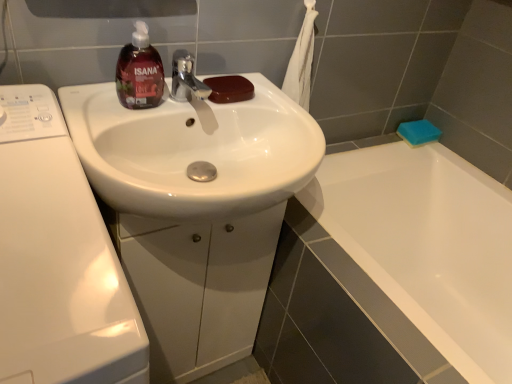
Question: From a real-world perspective, is brown glossy soap at center, which is the 1th soap in front-to-back order, positioned under white glossy cabinet at center based on gravity?

Choices:
 (A) yes
 (B) no

Answer: (B)

Question: Is brown glossy soap at center, which is the 2th soap in right-to-left order, not near white glossy cabinet at center?

Choices:
 (A) no
 (B) yes

Answer: (A)

Question: From the image's perspective, is brown glossy soap at center, the second soap from the back, on top of white glossy cabinet at center?

Choices:
 (A) no
 (B) yes

Answer: (B)

Question: Is brown glossy soap at center, the second soap from the back, to the left of white glossy cabinet at center from the viewer's perspective?

Choices:
 (A) yes
 (B) no

Answer: (B)

Question: Can you confirm if brown glossy soap at center, which is the 1th soap in front-to-back order, is wider than white glossy cabinet at center?

Choices:
 (A) no
 (B) yes

Answer: (A)

Question: Considering the positions of brown glossy soap at center, which is the 1th soap in front-to-back order, and white glossy cabinet at center in the image, is brown glossy soap at center, which is the 1th soap in front-to-back order, bigger or smaller than white glossy cabinet at center?

Choices:
 (A) small
 (B) big

Answer: (A)

Question: From the image's perspective, is brown glossy soap at center, placed as the first soap when sorted from left to right, located above or below white glossy cabinet at center?

Choices:
 (A) below
 (B) above

Answer: (B)

Question: From a real-world perspective, is brown glossy soap at center, which is the 2th soap in right-to-left order, positioned above or below white glossy cabinet at center?

Choices:
 (A) above
 (B) below

Answer: (A)

Question: Looking at their shapes, would you say brown glossy soap at center, which is the 2th soap in right-to-left order, is wider or thinner than white glossy cabinet at center?

Choices:
 (A) thin
 (B) wide

Answer: (A)

Question: Visually, is blue sponge at upper right, which is the first soap from right to left, positioned to the left or to the right of white glossy sink at center?

Choices:
 (A) right
 (B) left

Answer: (A)

Question: Looking at the image, does blue sponge at upper right, which appears as the first soap when viewed from the back, seem bigger or smaller compared to white glossy sink at center?

Choices:
 (A) big
 (B) small

Answer: (B)

Question: From a real-world perspective, is blue sponge at upper right, which is the first soap from right to left, physically located above or below white glossy sink at center?

Choices:
 (A) below
 (B) above

Answer: (A)

Question: Relative to white glossy sink at center, is blue sponge at upper right, which appears as the first soap when viewed from the back, in front or behind?

Choices:
 (A) front
 (B) behind

Answer: (B)

Question: Is brown glossy soap at center, which is the 2th soap in right-to-left order, taller or shorter than translucent dark red liquid soap at upper left?

Choices:
 (A) tall
 (B) short

Answer: (B)

Question: Does point (224, 84) appear closer or farther from the camera than point (116, 89)?

Choices:
 (A) closer
 (B) farther

Answer: (B)